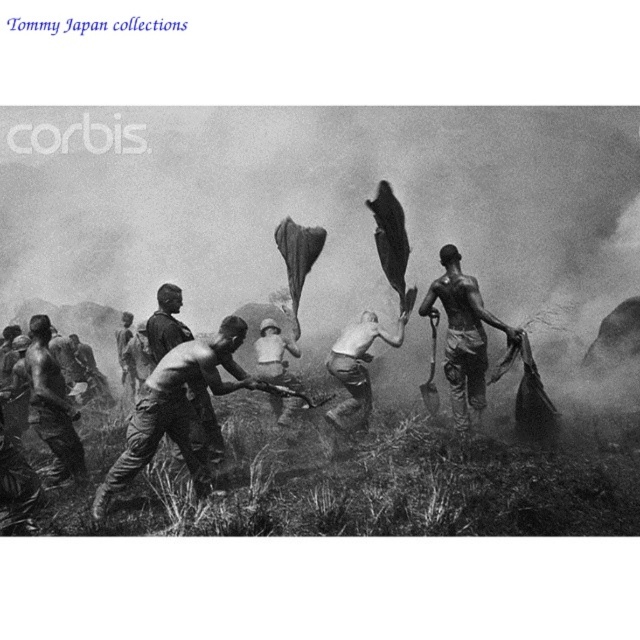
You are a photographer observing the scene. You want to capture a clear photo of the dirty skin man at left without the shiny metallic shovel at right blocking him. Is it possible to adjust your position to achieve this?

The dirty skin man at left is behind the shiny metallic shovel at right, so adjusting your position to frame the man without the shovel blocking him might not be possible unless you move to a position where the shovel is out of the line of sight. However, given the spatial arrangement described, the shovel is in front of the man, so moving around the shovel could allow you to photograph the man directly.

You are a worker in the scene and need to choose between the shiny metallic shovel at right and the shiny metallic helmet at center for a task that requires a taller object. Which one should you pick?

The shiny metallic shovel at right is much taller than the shiny metallic helmet at center, so you should pick the shiny metallic shovel at right for the task.